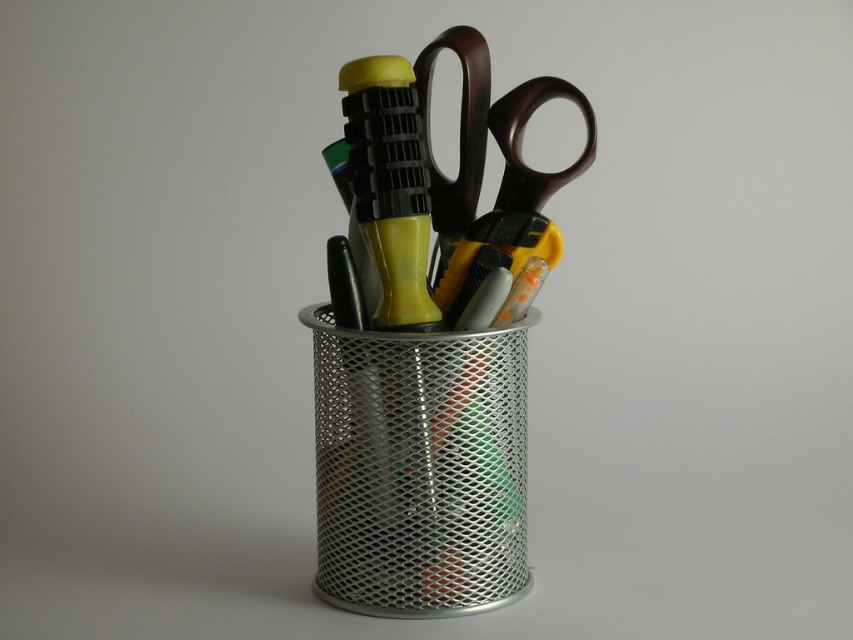
You are organizing your desk and have a metal mesh pen holder at center and brown plastic scissors at center. Which object can hold more items inside?

The metal mesh pen holder at center is bigger than the brown plastic scissors at center, so it can hold more items inside.

From the picture: You are standing 1.5 meters away from the metal mesh pen holder at center. Can you reach it without moving your feet?

The metal mesh pen holder at center is 1.04 meters away from camera, so if you are standing 1.5 meters away from it, you cannot reach it without moving your feet since the distance is greater than the typical arm length.

You are organizing your desk and want to place the brown plastic scissors at center into the metal mesh pen holder at center. Can you fit the scissors into the holder?

The metal mesh pen holder at center is positioned under the brown plastic scissors at center, so the scissors are already placed inside the holder.